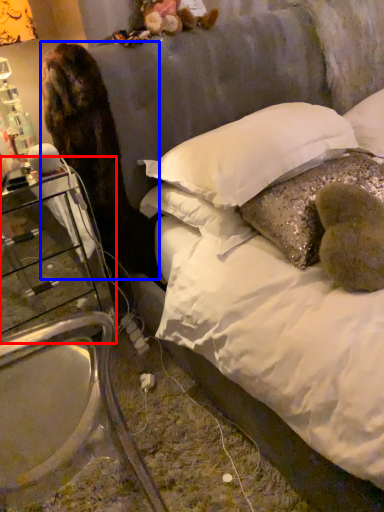
Question: Which point is further to the camera, nightstand (highlighted by a red box) or animal (highlighted by a blue box)?

Choices:
 (A) nightstand
 (B) animal

Answer: (A)